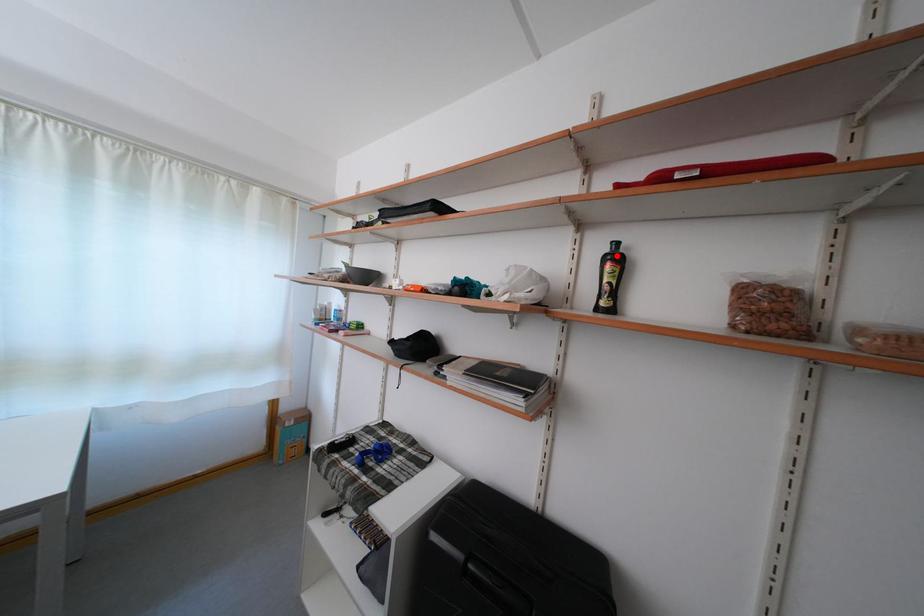
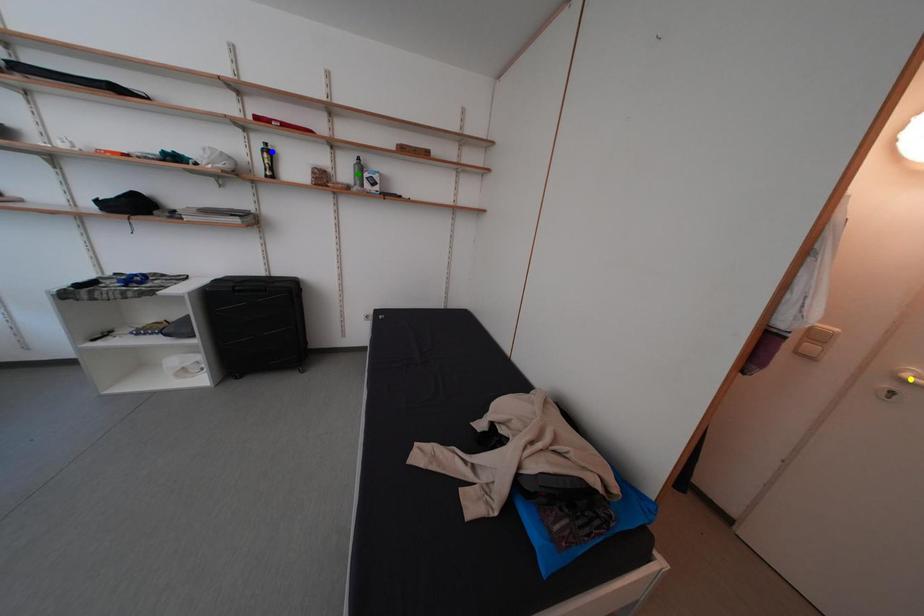
Question: I am providing you with two images of the same scene from different viewpoints. A red point is marked on the first image. You are given multiple points on the second image. Which point in image 2 is actually the same real-world point as the red point in image 1?

Choices:
 (A) green point
 (B) yellow point
 (C) blue point

Answer: (C)